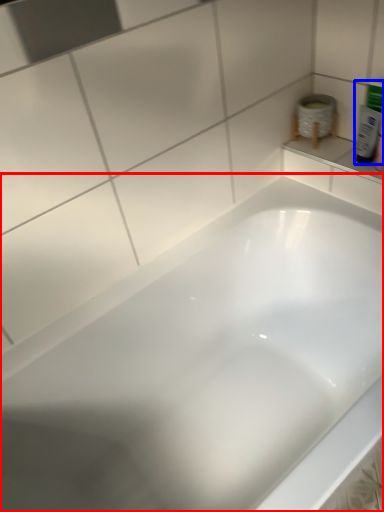
Question: Which of the following is the farthest to the observer, bathtub (highlighted by a red box) or mouthwash (highlighted by a blue box)?

Choices:
 (A) bathtub
 (B) mouthwash

Answer: (B)